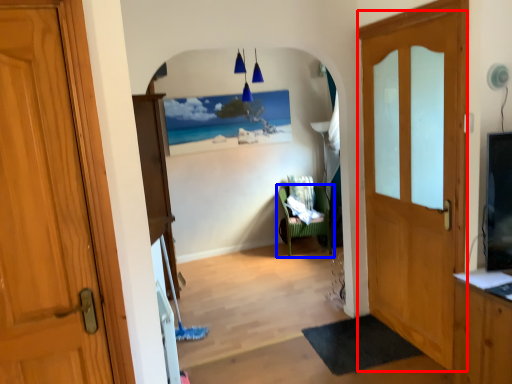
Question: Among these objects, which one is nearest to the camera, door (highlighted by a red box) or chair (highlighted by a blue box)?

Choices:
 (A) door
 (B) chair

Answer: (A)